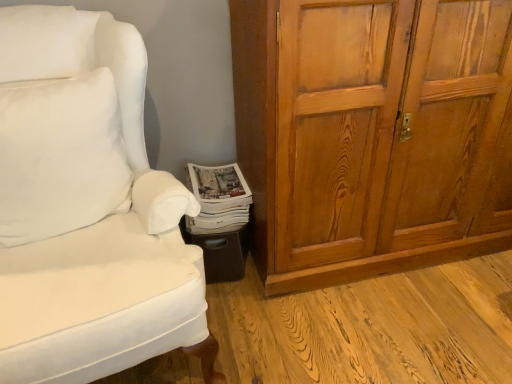
Measure the distance between point (128, 194) and camera.

Point (128, 194) is 1.36 meters away from camera.

What are the coordinates of `white glossy magazine at lower center` in the screenshot? It's located at (219, 198).

At what (x,y) coordinates should I click in order to perform the action: click on white soft pillow at left. Please return your answer as a coordinate pair (x, y). The image size is (512, 384). Looking at the image, I should click on (60, 156).

Which object is closer to the camera taking this photo, white fabric chair at lower left or wooden cabinet at right?

Positioned in front is white fabric chair at lower left.

Which is behind, point (120, 143) or point (378, 177)?

The point (378, 177) is behind.

Is white fabric chair at lower left looking in the opposite direction of wooden cabinet at right?

No, white fabric chair at lower left is not facing the opposite direction of wooden cabinet at right.

Is white fabric chair at lower left thinner than wooden cabinet at right?

No.

Between white glossy magazine at lower center and white fabric chair at lower left, which one has smaller size?

Smaller between the two is white glossy magazine at lower center.

In the scene shown: Is white glossy magazine at lower center shorter than white fabric chair at lower left?

Correct, white glossy magazine at lower center is not as tall as white fabric chair at lower left.

Considering the sizes of objects white glossy magazine at lower center and white fabric chair at lower left in the image provided, who is wider, white glossy magazine at lower center or white fabric chair at lower left?

white fabric chair at lower left.

Consider the image. How different are the orientations of white glossy magazine at lower center and white fabric chair at lower left in degrees?

9.56 degrees separate the facing orientations of white glossy magazine at lower center and white fabric chair at lower left.

Which object is wider, white fabric chair at lower left or white soft pillow at left?

white fabric chair at lower left is wider.

Is white fabric chair at lower left next to white soft pillow at left?

white fabric chair at lower left is not next to white soft pillow at left, and they're not touching.

Which is in front, point (47, 234) or point (77, 203)?

The point (47, 234) is in front.

Considering the relative positions of white soft pillow at left and wooden cabinet at right in the image provided, is white soft pillow at left to the left of wooden cabinet at right from the viewer's perspective?

Correct, you'll find white soft pillow at left to the left of wooden cabinet at right.

Is white soft pillow at left oriented towards wooden cabinet at right?

No, white soft pillow at left is not turned towards wooden cabinet at right.

Looking at this image, is white soft pillow at left in front of or behind white glossy magazine at lower center in the image?

Visually, white soft pillow at left is located in front of white glossy magazine at lower center.

What's the angular difference between white soft pillow at left and white glossy magazine at lower center's facing directions?

white soft pillow at left and white glossy magazine at lower center are facing 11.4 degrees away from each other.

From a real-world perspective, does white soft pillow at left sit lower than white glossy magazine at lower center?

No, from a real-world perspective, white soft pillow at left is not beneath white glossy magazine at lower center.

Visually, is white soft pillow at left positioned to the left or to the right of white glossy magazine at lower center?

In the image, white soft pillow at left appears on the left side of white glossy magazine at lower center.

At what (x,y) coordinates should I click in order to perform the action: click on pillow on the left of white fabric chair at lower left. Please return your answer as a coordinate pair (x, y). Looking at the image, I should click on (60, 156).

Who is smaller, white soft pillow at left or white fabric chair at lower left?

Smaller between the two is white soft pillow at left.

Is point (53, 149) more distant than point (82, 269)?

Yes, point (53, 149) is behind point (82, 269).

Which is more to the left, white soft pillow at left or white fabric chair at lower left?

From the viewer's perspective, white soft pillow at left appears more on the left side.

You are a GUI agent. You are given a task and a screenshot of the screen. Output one action in this format:
    pyautogui.click(x=<x>, y=<y>)
    Task: Click on the chair below the wooden cabinet at right (from a real-world perspective)
    
    Given the screenshot: What is the action you would take?
    pyautogui.click(x=89, y=210)

Between wooden cabinet at right and white fabric chair at lower left, which one has smaller width?

wooden cabinet at right.

In the scene shown: Is wooden cabinet at right outside of white fabric chair at lower left?

Yes, wooden cabinet at right is located beyond the bounds of white fabric chair at lower left.

Between wooden cabinet at right and white fabric chair at lower left, which one is positioned behind?

A: Positioned behind is wooden cabinet at right.

Locate an element on the screen. The width and height of the screenshot is (512, 384). chair below the wooden cabinet at right (from a real-world perspective) is located at coordinates pos(89,210).

Identify the location of magazine that appears above the white fabric chair at lower left (from the image's perspective). (219, 198).

Based on their spatial positions, is white glossy magazine at lower center or wooden cabinet at right closer to white fabric chair at lower left?

white glossy magazine at lower center is closer to white fabric chair at lower left.

Considering their positions, is white soft pillow at left positioned closer to white glossy magazine at lower center than wooden cabinet at right?

The object closer to white glossy magazine at lower center is white soft pillow at left.

Consider the image. From the image, which object appears to be nearer to white glossy magazine at lower center, white fabric chair at lower left or wooden cabinet at right?

white fabric chair at lower left lies closer to white glossy magazine at lower center than the other object.

Estimate the real-world distances between objects in this image. Which object is closer to white soft pillow at left, wooden cabinet at right or white fabric chair at lower left?

Based on the image, white fabric chair at lower left appears to be nearer to white soft pillow at left.

Looking at the image, which one is located further to white soft pillow at left, white glossy magazine at lower center or wooden cabinet at right?

Based on the image, wooden cabinet at right appears to be further to white soft pillow at left.

Based on their spatial positions, is white glossy magazine at lower center or white soft pillow at left further from white fabric chair at lower left?

white glossy magazine at lower center lies further to white fabric chair at lower left than the other object.

Looking at the image, which one is located closer to wooden cabinet at right, white soft pillow at left or white glossy magazine at lower center?

white glossy magazine at lower center.

Considering their positions, is white glossy magazine at lower center positioned further to white soft pillow at left than white fabric chair at lower left?

white glossy magazine at lower center is further to white soft pillow at left.

Where is `magazine situated between white soft pillow at left and wooden cabinet at right from left to right`? The image size is (512, 384). magazine situated between white soft pillow at left and wooden cabinet at right from left to right is located at coordinates (219, 198).

Identify the location of chair located between white soft pillow at left and wooden cabinet at right in the left-right direction. This screenshot has height=384, width=512. (89, 210).

Find the location of a particular element. This screenshot has height=384, width=512. pillow between white fabric chair at lower left and white glossy magazine at lower center in the front-back direction is located at coordinates (60, 156).

Locate an element on the screen. Image resolution: width=512 pixels, height=384 pixels. magazine between white fabric chair at lower left and wooden cabinet at right in the horizontal direction is located at coordinates (x=219, y=198).